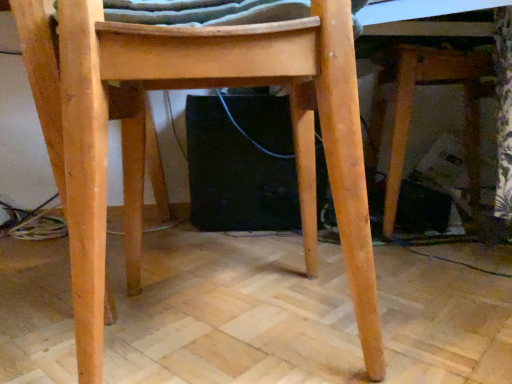
Describe the element at coordinates (411, 109) in the screenshot. I see `natural wood table at lower right` at that location.

Identify the location of natural wood table at lower right. (411, 109).

What is the approximate height of natural wood table at lower right?

natural wood table at lower right is 24.36 inches tall.

At what (x,y) coordinates should I click in order to perform the action: click on natural wood chair at center. Please return your answer as a coordinate pair (x, y). The height and width of the screenshot is (384, 512). Looking at the image, I should click on (146, 134).

Describe the element at coordinates (146, 134) in the screenshot. I see `natural wood chair at center` at that location.

Identify the location of natural wood table at lower right. This screenshot has height=384, width=512. (411, 109).

Which object is positioned more to the right, natural wood table at lower right or natural wood chair at center?

natural wood table at lower right is more to the right.

Considering the positions of objects natural wood table at lower right and natural wood chair at center in the image provided, who is in front, natural wood table at lower right or natural wood chair at center?

natural wood chair at center is closer to the camera.

Is point (476, 23) closer to viewer compared to point (74, 222)?

No.

From the image's perspective, which is below, natural wood table at lower right or natural wood chair at center?

natural wood chair at center, from the image's perspective.

From a real-world perspective, is natural wood table at lower right located beneath natural wood chair at center?

No, from a real-world perspective, natural wood table at lower right is not below natural wood chair at center.

Considering the sizes of objects natural wood table at lower right and natural wood chair at center in the image provided, who is wider, natural wood table at lower right or natural wood chair at center?

natural wood table at lower right.

Consider the image. Considering the relative sizes of natural wood table at lower right and natural wood chair at center in the image provided, is natural wood table at lower right shorter than natural wood chair at center?

Incorrect, the height of natural wood table at lower right does not fall short of that of natural wood chair at center.

Looking at the image, does natural wood table at lower right seem bigger or smaller compared to natural wood chair at center?

natural wood table at lower right is bigger than natural wood chair at center.

Consider the image. Does natural wood table at lower right contain natural wood chair at center?

No, natural wood chair at center is not a part of natural wood table at lower right.

Is natural wood table at lower right next to natural wood chair at center and touching it?

natural wood table at lower right and natural wood chair at center are clearly separated.

Is natural wood table at lower right looking in the opposite direction of natural wood chair at center?

No.

How many degrees apart are the facing directions of natural wood table at lower right and natural wood chair at center?

167 degrees.

Identify the location of chair in front of the natural wood table at lower right. (146, 134).

Which object is positioned more to the right, natural wood chair at center or natural wood table at lower right?

Positioned to the right is natural wood table at lower right.

Considering the positions of objects natural wood chair at center and natural wood table at lower right in the image provided, who is in front, natural wood chair at center or natural wood table at lower right?

Positioned in front is natural wood chair at center.

Between point (368, 353) and point (405, 138), which one is positioned in front?

Positioned in front is point (368, 353).

From the image's perspective, which one is positioned higher, natural wood chair at center or natural wood table at lower right?

From the image's view, natural wood table at lower right is above.

In the scene shown: From a real-world perspective, which is physically below, natural wood chair at center or natural wood table at lower right?

natural wood chair at center, from a real-world perspective.

In the scene shown: Which of these two, natural wood chair at center or natural wood table at lower right, is wider?

natural wood table at lower right is wider.

Is natural wood chair at center taller than natural wood table at lower right?

Incorrect, the height of natural wood chair at center is not larger of that of natural wood table at lower right.

Consider the image. Looking at the image, does natural wood chair at center seem bigger or smaller compared to natural wood table at lower right?

Considering their sizes, natural wood chair at center takes up less space than natural wood table at lower right.

Is natural wood chair at center spatially inside natural wood table at lower right, or outside of it?

natural wood chair at center cannot be found inside natural wood table at lower right.

Are natural wood chair at center and natural wood table at lower right beside each other?

No.

Could you tell me if natural wood chair at center is facing natural wood table at lower right?

No, natural wood chair at center is not facing towards natural wood table at lower right.

At what (x,y) coordinates should I click in order to perform the action: click on chair that appears in front of the natural wood table at lower right. Please return your answer as a coordinate pair (x, y). Looking at the image, I should click on (146, 134).

The width and height of the screenshot is (512, 384). I want to click on chair on the left of natural wood table at lower right, so click(146, 134).

Identify the location of table lying above the natural wood chair at center (from the image's perspective). click(411, 109).